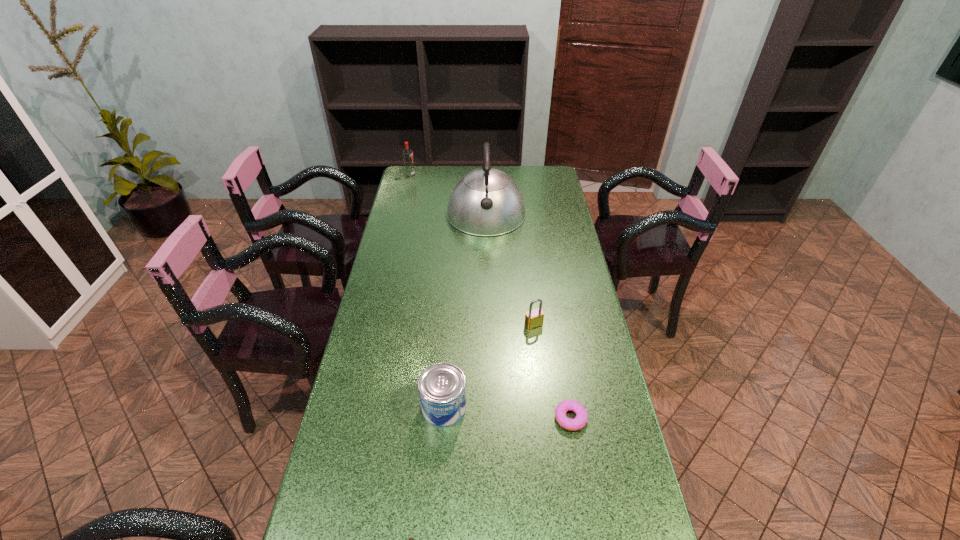
This screenshot has width=960, height=540. What are the coordinates of `vacant space located on the front of the padlock` in the screenshot? It's located at (537, 348).

At what (x,y) coordinates should I click in order to perform the action: click on free space located 0.380m on the left of the shortest object. Please return your answer as a coordinate pair (x, y). Looking at the image, I should click on (410, 418).

You are a GUI agent. You are given a task and a screenshot of the screen. Output one action in this format:
    pyautogui.click(x=<x>, y=<y>)
    Task: Click on the object situated at the far edge
    
    Given the screenshot: What is the action you would take?
    pyautogui.click(x=407, y=155)

In order to click on object that is positioned at the left edge in this screenshot , I will do pyautogui.click(x=407, y=155).

Locate an element on the screen. object present at the right edge is located at coordinates (579, 422).

The image size is (960, 540). I want to click on object that is at the far left corner, so click(x=407, y=155).

Where is `vacant space at the left edge`? The width and height of the screenshot is (960, 540). vacant space at the left edge is located at coordinates (411, 309).

Find the location of `free space at the right edge`. free space at the right edge is located at coordinates (564, 217).

You are a GUI agent. You are given a task and a screenshot of the screen. Output one action in this format:
    pyautogui.click(x=<x>, y=<y>)
    Task: Click on the vacant space at the far left corner of the desktop
    The width and height of the screenshot is (960, 540).
    Given the screenshot: What is the action you would take?
    coord(422,174)

The width and height of the screenshot is (960, 540). In order to click on vacant area between the second tallest object and the shortest object in this screenshot , I will do `click(491, 296)`.